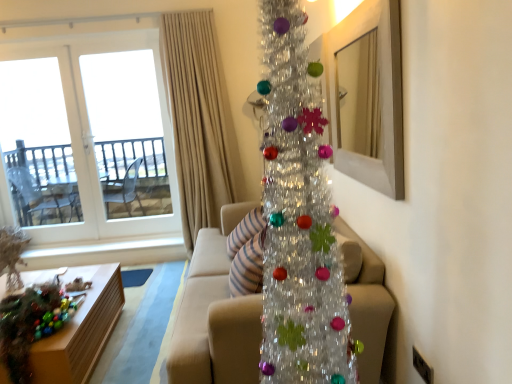
Question: From the image's perspective, is beige fabric curtain at upper center under wooden table at lower left?

Choices:
 (A) no
 (B) yes

Answer: (A)

Question: Is beige fabric curtain at upper center outside of wooden table at lower left?

Choices:
 (A) yes
 (B) no

Answer: (A)

Question: Can wooden table at lower left be found inside beige fabric curtain at upper center?

Choices:
 (A) yes
 (B) no

Answer: (B)

Question: Is beige fabric curtain at upper center shorter than wooden table at lower left?

Choices:
 (A) no
 (B) yes

Answer: (A)

Question: Are beige fabric curtain at upper center and wooden table at lower left far apart?

Choices:
 (A) no
 (B) yes

Answer: (B)

Question: Is beige fabric curtain at upper center taller or shorter than wooden mirror at upper right?

Choices:
 (A) short
 (B) tall

Answer: (B)

Question: Is beige fabric curtain at upper center inside or outside of wooden mirror at upper right?

Choices:
 (A) inside
 (B) outside

Answer: (B)

Question: Looking at their shapes, would you say beige fabric curtain at upper center is wider or thinner than wooden mirror at upper right?

Choices:
 (A) wide
 (B) thin

Answer: (A)

Question: Is point (178, 31) positioned closer to the camera than point (343, 39)?

Choices:
 (A) farther
 (B) closer

Answer: (A)

Question: From a real-world perspective, is wooden mirror at upper right physically located above or below transparent glass door at upper left?

Choices:
 (A) below
 (B) above

Answer: (B)

Question: Is wooden mirror at upper right spatially inside transparent glass door at upper left, or outside of it?

Choices:
 (A) inside
 (B) outside

Answer: (B)

Question: In terms of width, does wooden mirror at upper right look wider or thinner when compared to transparent glass door at upper left?

Choices:
 (A) thin
 (B) wide

Answer: (A)

Question: Considering the positions of wooden mirror at upper right and transparent glass door at upper left in the image, is wooden mirror at upper right taller or shorter than transparent glass door at upper left?

Choices:
 (A) short
 (B) tall

Answer: (A)

Question: Is wooden mirror at upper right in front of or behind beige fabric curtain at upper center in the image?

Choices:
 (A) behind
 (B) front

Answer: (B)

Question: From a real-world perspective, is wooden mirror at upper right physically located above or below beige fabric curtain at upper center?

Choices:
 (A) below
 (B) above

Answer: (B)